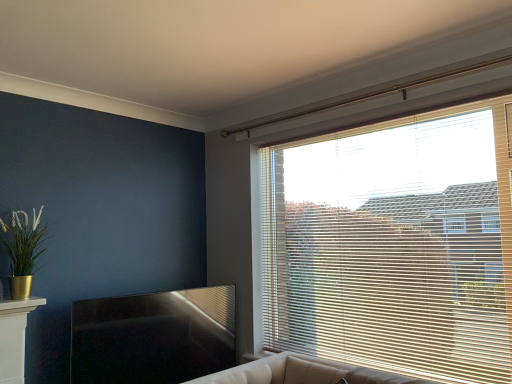
Question: Looking at their shapes, would you say gold metallic pot at left is wider or thinner than wooden blinds at upper right?

Choices:
 (A) thin
 (B) wide

Answer: (B)

Question: Considering the positions of point (34, 218) and point (262, 264), is point (34, 218) closer or farther from the camera than point (262, 264)?

Choices:
 (A) farther
 (B) closer

Answer: (B)

Question: From the image's perspective, is gold metallic pot at left above or below wooden blinds at upper right?

Choices:
 (A) below
 (B) above

Answer: (A)

Question: In the image, is wooden blinds at upper right positioned in front of or behind gold metallic pot at left?

Choices:
 (A) behind
 (B) front

Answer: (B)

Question: From a real-world perspective, is wooden blinds at upper right physically located above or below gold metallic pot at left?

Choices:
 (A) below
 (B) above

Answer: (A)

Question: Is wooden blinds at upper right to the left or to the right of gold metallic pot at left in the image?

Choices:
 (A) left
 (B) right

Answer: (B)

Question: In terms of width, does wooden blinds at upper right look wider or thinner when compared to gold metallic pot at left?

Choices:
 (A) thin
 (B) wide

Answer: (A)